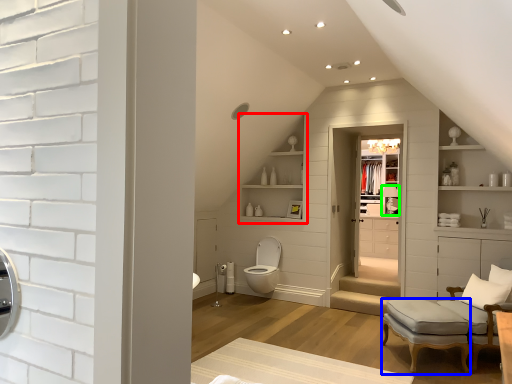
Question: Which is nearer to the shelf (highlighted by a red box)? stool (highlighted by a blue box) or lamp (highlighted by a green box).

Choices:
 (A) stool
 (B) lamp

Answer: (B)